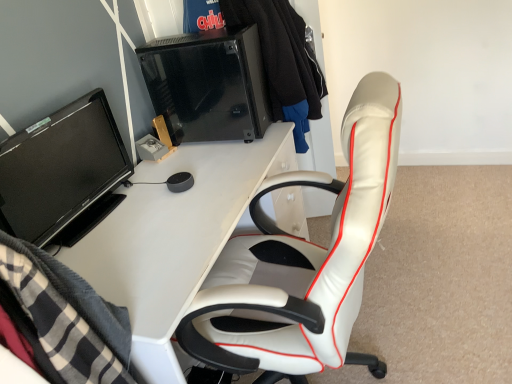
You are a GUI agent. You are given a task and a screenshot of the screen. Output one action in this format:
    pyautogui.click(x=<x>, y=<y>)
    Task: Click on the empty space that is to the right of black glossy monitor at left
    
    Given the screenshot: What is the action you would take?
    pyautogui.click(x=172, y=202)